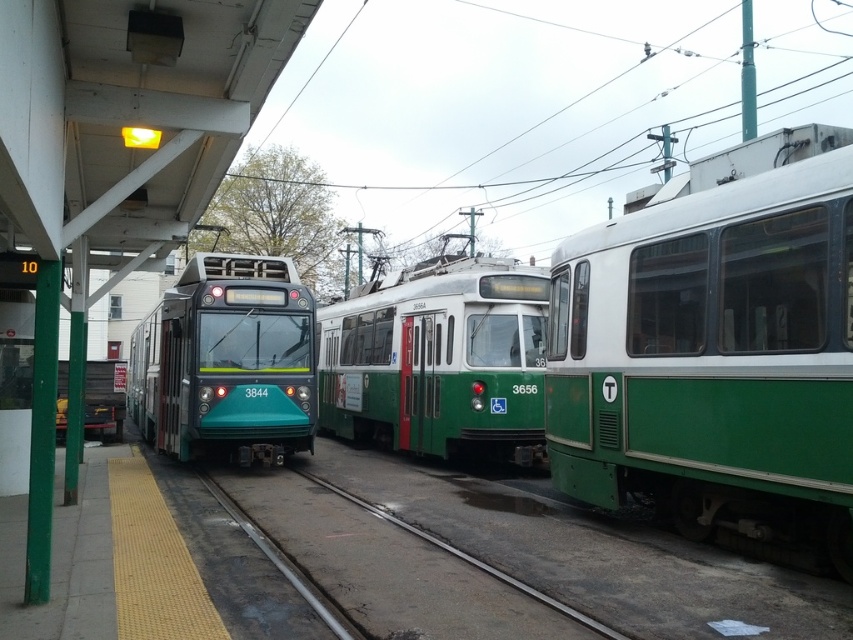
Does green matte train at right appear over teal glossy train at center?

Indeed, green matte train at right is positioned over teal glossy train at center.

The image size is (853, 640). Find the location of `green matte train at right`. green matte train at right is located at coordinates (712, 358).

Locate an element on the screen. green matte train at right is located at coordinates [712, 358].

Does teal glossy train at center have a lesser width compared to metal at center?

No.

Which is more to the right, teal glossy train at center or metal at center?

metal at center

Describe the element at coordinates (227, 362) in the screenshot. The height and width of the screenshot is (640, 853). I see `teal glossy train at center` at that location.

The width and height of the screenshot is (853, 640). I want to click on teal glossy train at center, so click(227, 362).

Which of these two, green matte train at center or teal glossy train at center, stands shorter?

green matte train at center

Locate an element on the screen. green matte train at center is located at coordinates (439, 358).